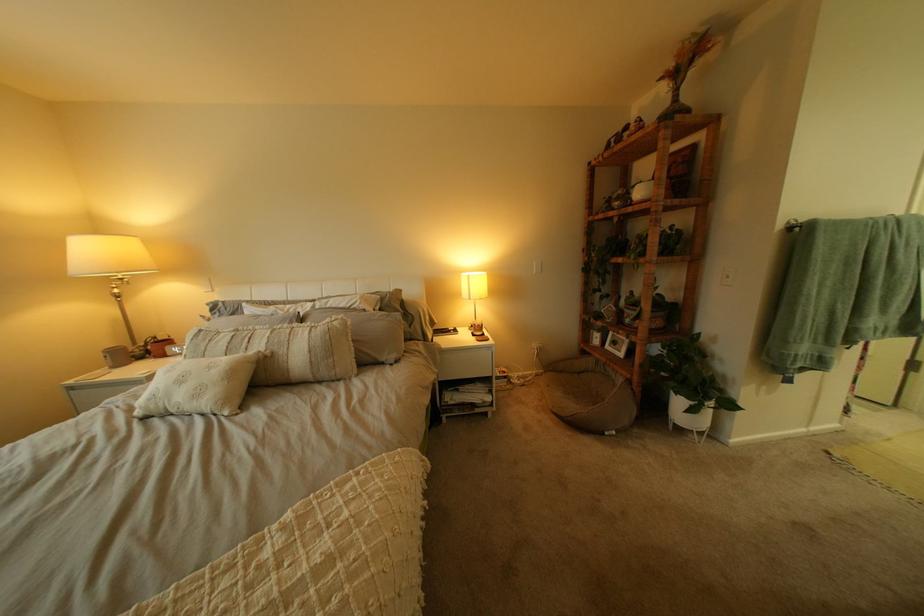
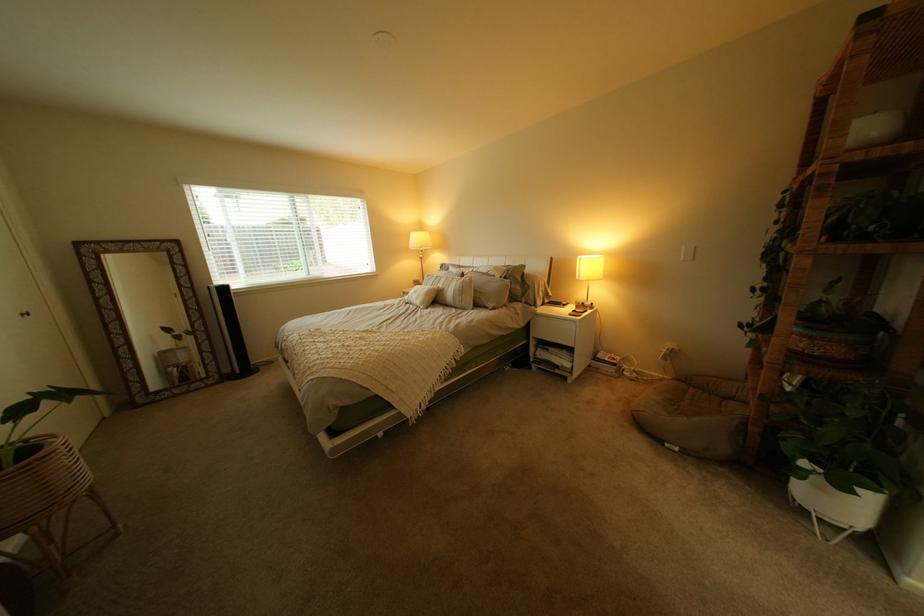
Where in the second image is the point corresponding to point 666,331 from the first image?

(805, 354)